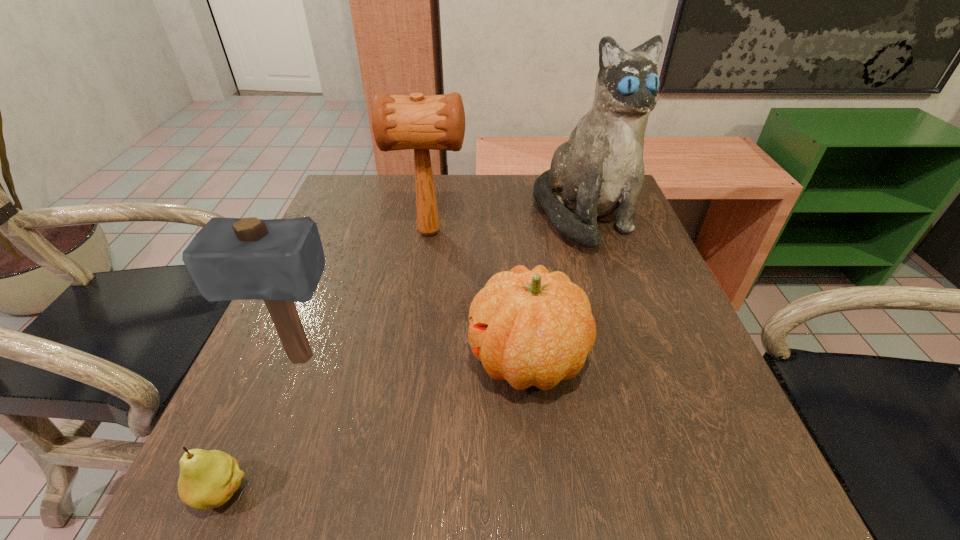
Where is `vacant space that satisfies the following two spatial constraints: 1. at the face of the cat; 2. on the strike surface of the third object from left to right`? Image resolution: width=960 pixels, height=540 pixels. vacant space that satisfies the following two spatial constraints: 1. at the face of the cat; 2. on the strike surface of the third object from left to right is located at coordinates (588, 232).

Locate an element on the screen. The height and width of the screenshot is (540, 960). vacant region that satisfies the following two spatial constraints: 1. on the strike surface of the farther mallet; 2. on the front side of the nearer mallet is located at coordinates coord(411,357).